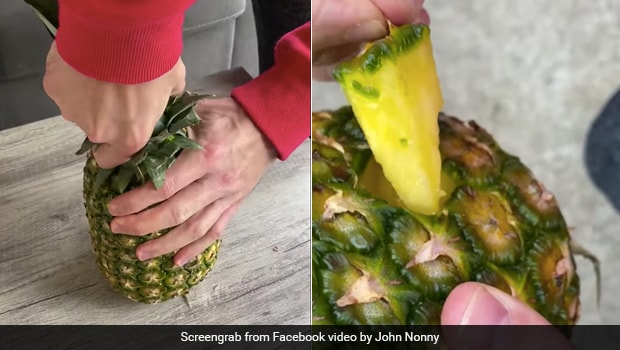
The width and height of the screenshot is (620, 350). In order to click on table in this screenshot , I will do `click(276, 229)`, `click(32, 236)`.